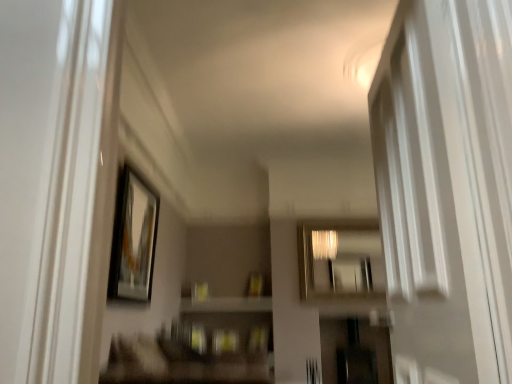
Question: Is matte black picture frame at upper left far from white glossy screen door at right?

Choices:
 (A) yes
 (B) no

Answer: (A)

Question: From the image's perspective, is matte black picture frame at upper left beneath white glossy screen door at right?

Choices:
 (A) yes
 (B) no

Answer: (A)

Question: Is matte black picture frame at upper left positioned with its back to white glossy screen door at right?

Choices:
 (A) yes
 (B) no

Answer: (B)

Question: Does matte black picture frame at upper left lie behind white glossy screen door at right?

Choices:
 (A) no
 (B) yes

Answer: (B)

Question: Considering the relative sizes of matte black picture frame at upper left and white glossy screen door at right in the image provided, is matte black picture frame at upper left taller than white glossy screen door at right?

Choices:
 (A) yes
 (B) no

Answer: (B)

Question: Which is correct: white glossy screen door at right is inside metallic reflective mirror at center, or outside of it?

Choices:
 (A) inside
 (B) outside

Answer: (B)

Question: In terms of width, does white glossy screen door at right look wider or thinner when compared to metallic reflective mirror at center?

Choices:
 (A) wide
 (B) thin

Answer: (A)

Question: In terms of size, does white glossy screen door at right appear bigger or smaller than metallic reflective mirror at center?

Choices:
 (A) small
 (B) big

Answer: (B)

Question: Would you say white glossy screen door at right is to the left or to the right of metallic reflective mirror at center in the picture?

Choices:
 (A) left
 (B) right

Answer: (A)

Question: Considering the positions of point (352, 241) and point (132, 178), is point (352, 241) closer or farther from the camera than point (132, 178)?

Choices:
 (A) farther
 (B) closer

Answer: (A)

Question: Would you say metallic reflective mirror at center is inside or outside matte black picture frame at upper left?

Choices:
 (A) inside
 (B) outside

Answer: (B)

Question: From a real-world perspective, is metallic reflective mirror at center physically located above or below matte black picture frame at upper left?

Choices:
 (A) above
 (B) below

Answer: (A)

Question: From the image's perspective, is metallic reflective mirror at center positioned above or below matte black picture frame at upper left?

Choices:
 (A) below
 (B) above

Answer: (A)

Question: Is matte black picture frame at upper left in front of or behind metallic reflective mirror at center in the image?

Choices:
 (A) front
 (B) behind

Answer: (A)

Question: From the image's perspective, is matte black picture frame at upper left positioned above or below metallic reflective mirror at center?

Choices:
 (A) below
 (B) above

Answer: (B)